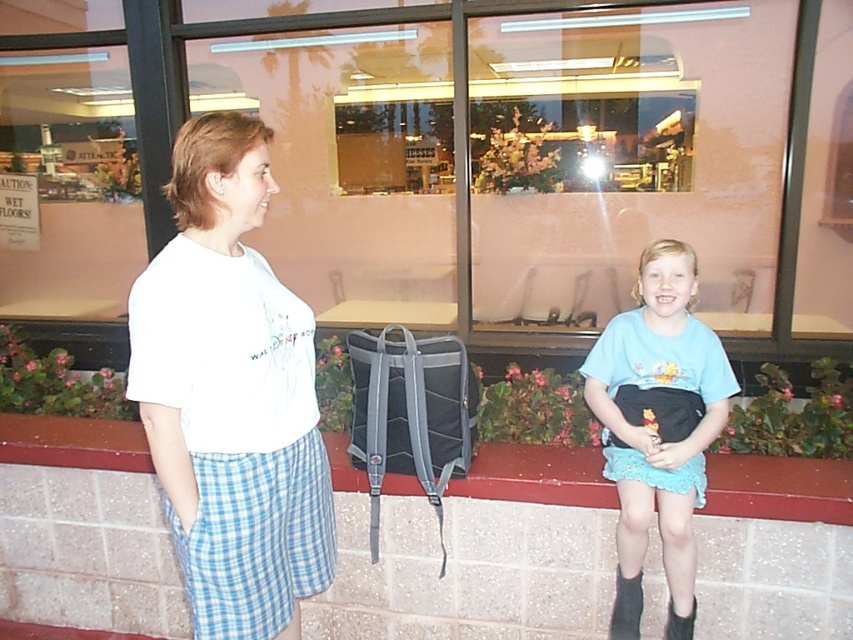
Does black suede boot at lower right appear on the left side of black fabric boot at lower right?

Yes, black suede boot at lower right is to the left of black fabric boot at lower right.

Between point (613, 604) and point (682, 625), which one is positioned in front?

Point (682, 625)

At what (x,y) coordinates should I click in order to perform the action: click on black suede boot at lower right. Please return your answer as a coordinate pair (x, y). The width and height of the screenshot is (853, 640). Looking at the image, I should click on (625, 608).

Is light blue fabric skirt at lower right to the right of black fabric boot at lower right from the viewer's perspective?

In fact, light blue fabric skirt at lower right is to the left of black fabric boot at lower right.

The image size is (853, 640). What do you see at coordinates (659, 412) in the screenshot?
I see `light blue fabric skirt at lower right` at bounding box center [659, 412].

This screenshot has width=853, height=640. Identify the location of light blue fabric skirt at lower right. (659, 412).

Where is `light blue fabric skirt at lower right`? The height and width of the screenshot is (640, 853). light blue fabric skirt at lower right is located at coordinates click(659, 412).

Can you confirm if light blue fabric skirt at lower right is positioned below brick ledge at lower center?

No.

Does light blue fabric skirt at lower right appear on the left side of brick ledge at lower center?

No, light blue fabric skirt at lower right is not to the left of brick ledge at lower center.

Who is more forward, (688, 304) or (727, 493)?

Point (727, 493) is more forward.

The height and width of the screenshot is (640, 853). I want to click on light blue fabric skirt at lower right, so click(x=659, y=412).